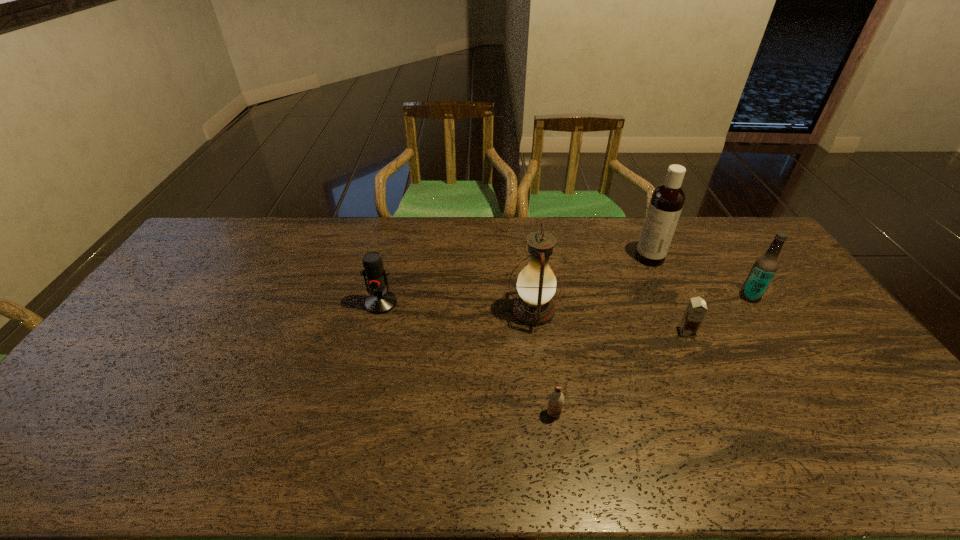
Locate an element on the screen. vacant space situated 0.390m on the label side of the farthest object is located at coordinates (526, 258).

I want to click on vacant space located 0.120m on the label side of the farthest object, so click(602, 258).

This screenshot has height=540, width=960. What are the coordinates of `vacant point located 0.070m on the label side of the farthest object` in the screenshot? It's located at (616, 258).

Image resolution: width=960 pixels, height=540 pixels. I want to click on vacant space located on the back of the oil lamp, so click(526, 255).

Find the location of a particular element. Image resolution: width=960 pixels, height=540 pixels. free region located on the label of the third tallest object is located at coordinates pos(653,296).

Image resolution: width=960 pixels, height=540 pixels. I want to click on vacant space positioned on the label of the third tallest object, so click(x=693, y=296).

You are a GUI agent. You are given a task and a screenshot of the screen. Output one action in this format:
    pyautogui.click(x=<x>, y=<y>)
    Task: Click on the blank space located 0.110m on the label of the third tallest object
    This screenshot has height=540, width=960.
    Given the screenshot: What is the action you would take?
    pyautogui.click(x=706, y=296)

Find the location of `blank space located 0.400m on the side of the leftmost object with the red ring`. blank space located 0.400m on the side of the leftmost object with the red ring is located at coordinates (349, 434).

The image size is (960, 540). I want to click on vacant space positioned on the left of the right chocolate milk, so click(x=544, y=332).

This screenshot has width=960, height=540. What are the coordinates of `free location located on the right of the shorter chocolate milk` in the screenshot? It's located at (721, 414).